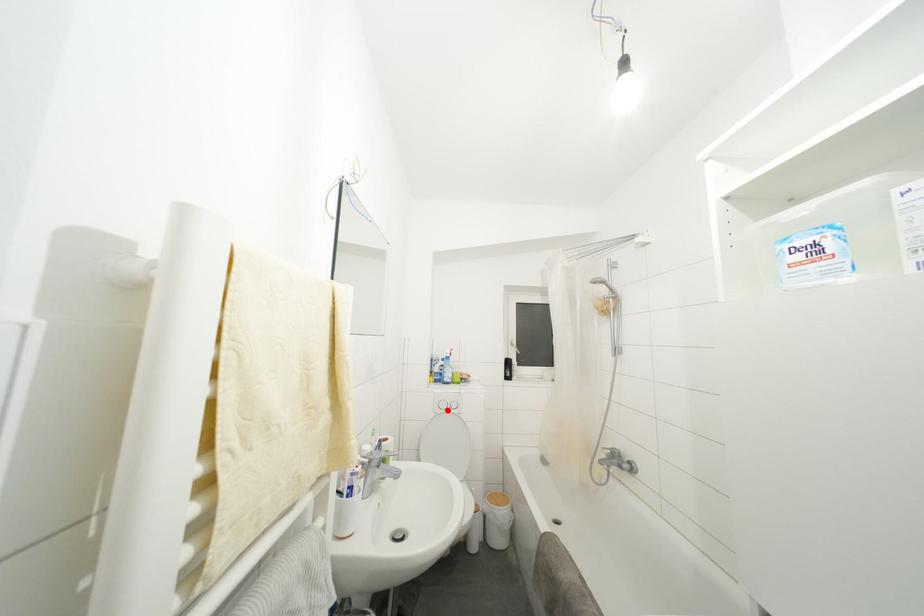
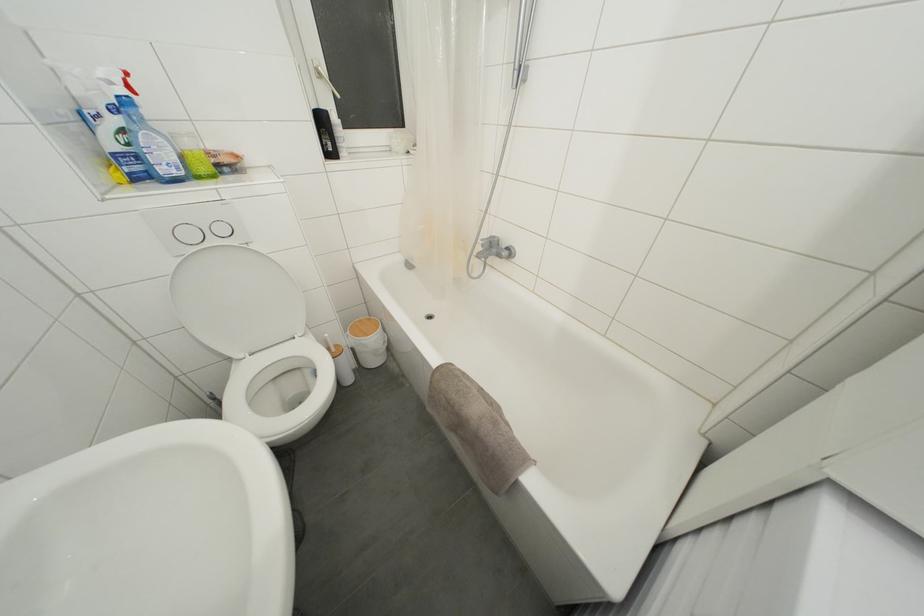
Where in the second image is the point corresponding to the highlighted location from the first image?

(195, 240)